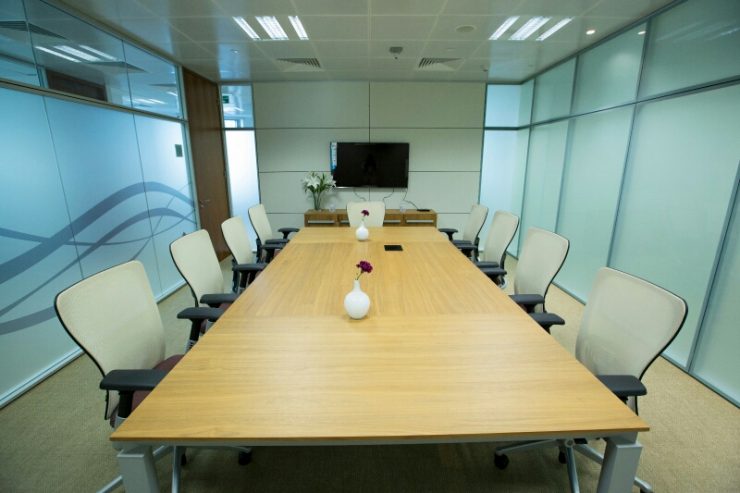
Locate an element on the screen. Image resolution: width=740 pixels, height=493 pixels. panels between overhead lights is located at coordinates click(x=477, y=29), click(x=394, y=26), click(x=329, y=25).